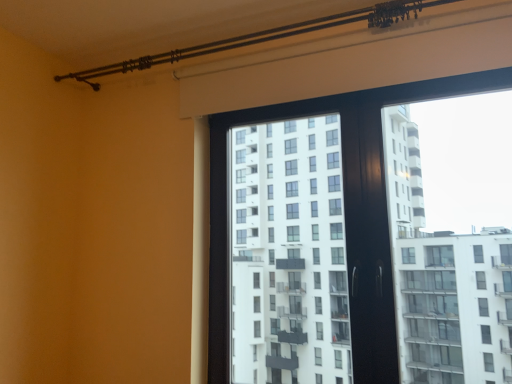
Describe the element at coordinates (344, 206) in the screenshot. I see `transparent glass window at upper center` at that location.

Where is `transparent glass window at upper center`? Image resolution: width=512 pixels, height=384 pixels. transparent glass window at upper center is located at coordinates (344, 206).

Identify the location of transparent glass window at upper center. (344, 206).